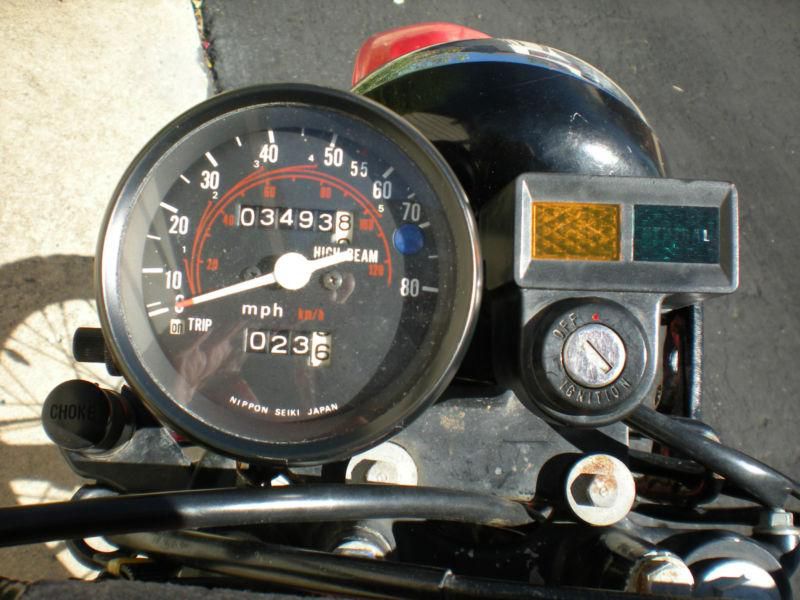
I want to click on light, so click(x=450, y=45).